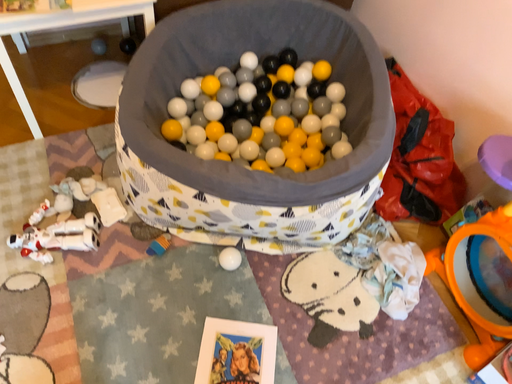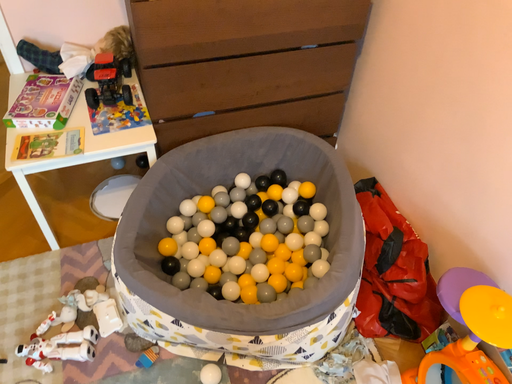
Question: How did the camera likely rotate when shooting the video?

Choices:
 (A) rotated upward
 (B) rotated downward

Answer: (A)